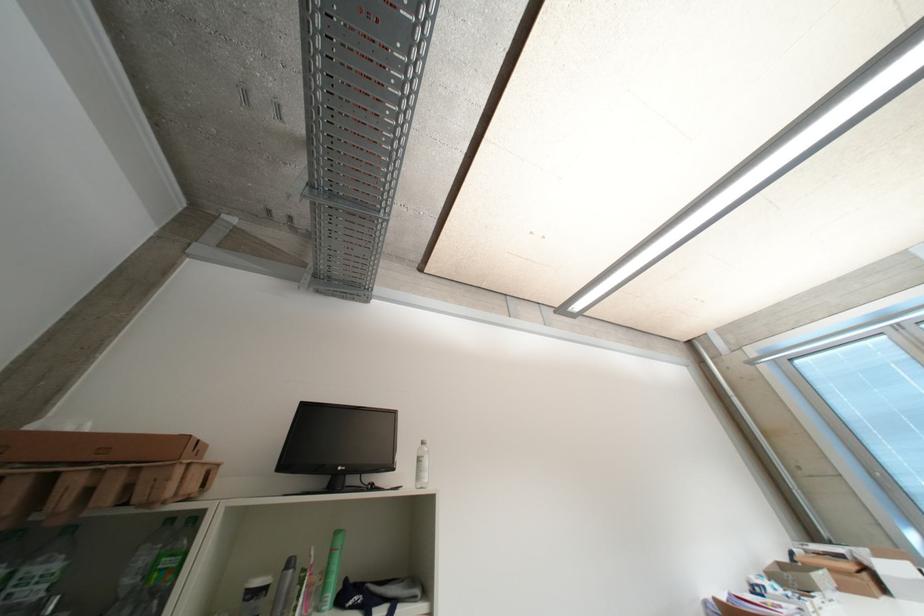
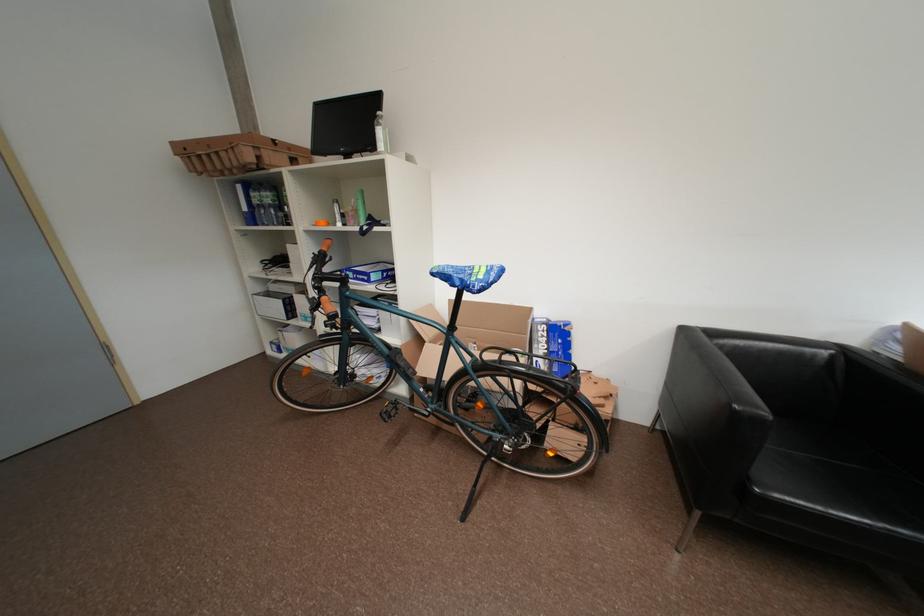
Where in the second image is the point corresponding to pixel 433 479 from the first image?

(388, 148)